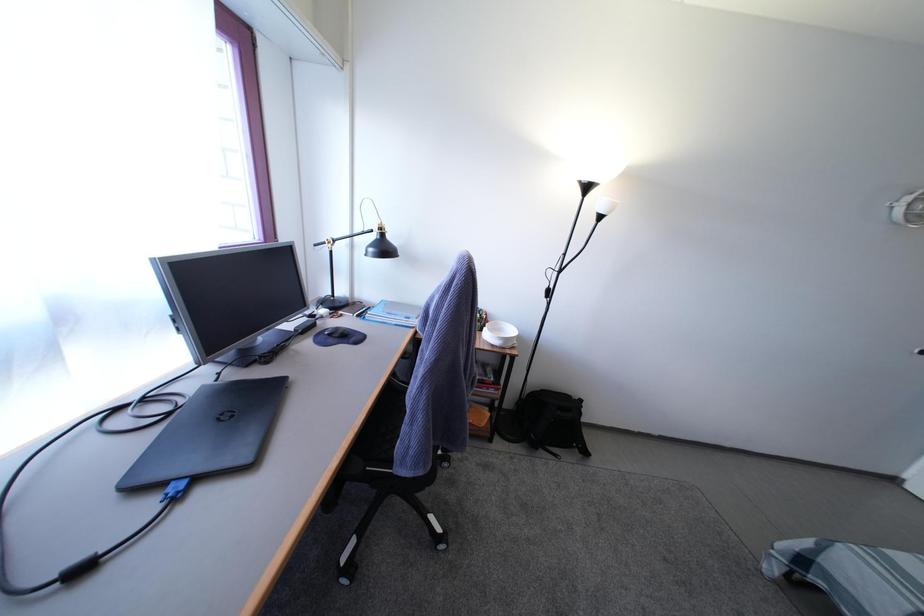
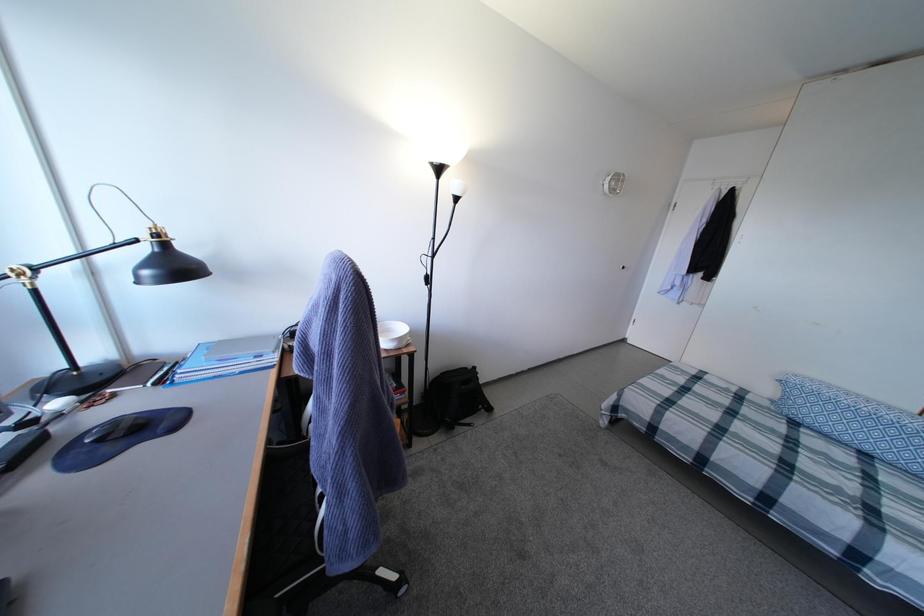
Question: Based on the continuous images, in which direction is the camera rotating? Reply with the corresponding letter.

Choices:
 (A) Left
 (B) Right
 (C) Up
 (D) Down

Answer: (B)